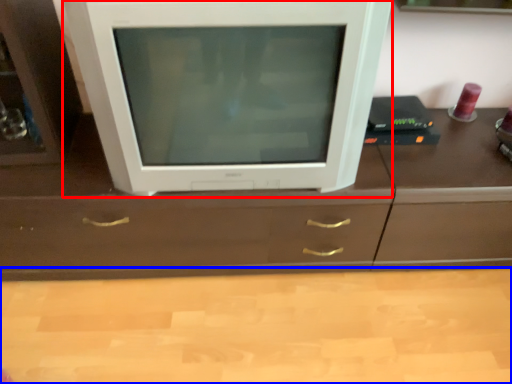
Question: Which of the following is the closest to the observer, television (highlighted by a red box) or counter top (highlighted by a blue box)?

Choices:
 (A) television
 (B) counter top

Answer: (A)